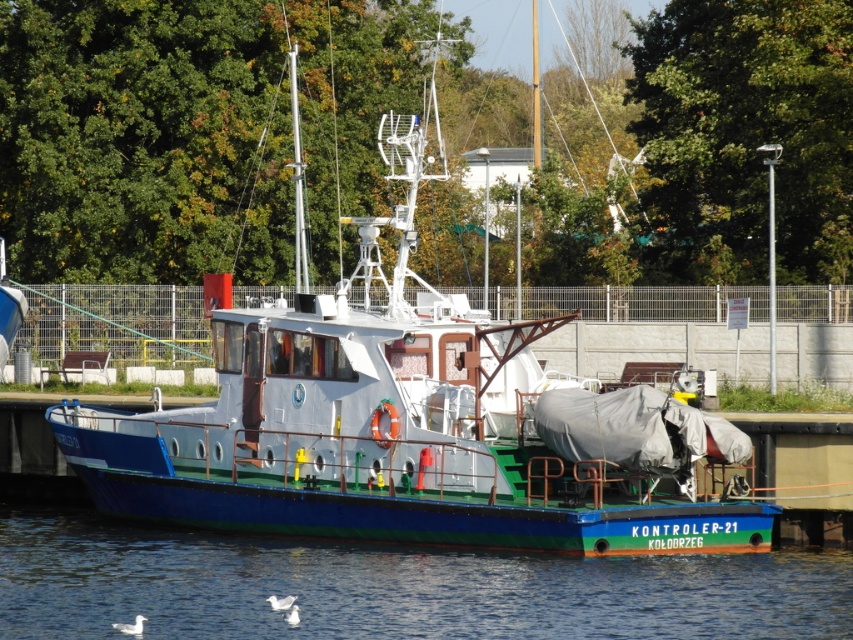
You are standing at the point marked as point (566, 442) on a map of the boat. You need to take a photo of the boat from a distance of at least 30 meters to ensure the entire vessel fits in the frame. Can you take the photo from your current position?

The distance between you at point (566, 442) and the camera is 34.65 meters, which is more than the required 30 meters. Therefore, you can take the photo from your current position to ensure the entire boat fits in the frame.

You are a drone operator tasked with capturing aerial footage of the blue matte boat at center. The drone must maintain a minimum altitude of 10 meters to avoid detection. Given the boat is at coordinates 0.664, 0.485, can you confirm the drone can safely hover above it without violating the altitude restriction?

The blue matte boat at center is located at coordinates [413,424]. Since the drone must maintain a minimum altitude of 10 meters to avoid detection, it can safely hover above the boat as long as it stays at or above that height.

You are standing on the pier and want to locate the point at coordinates (413,424). Based on the scene description, where would this point be located?

The point at coordinates (413,424) is on the blue matte boat at center.